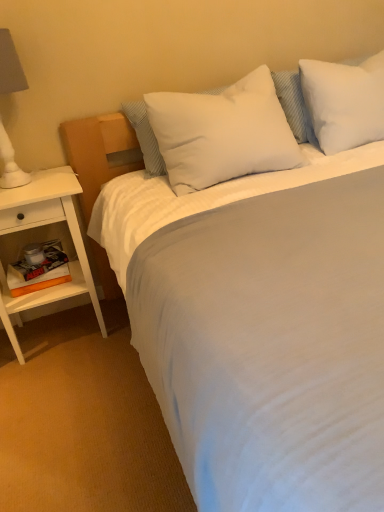
Question: Does white wood nightstand at left have a lesser height compared to white soft pillow at upper right, which is the second pillow from left to right?

Choices:
 (A) no
 (B) yes

Answer: (A)

Question: From a real-world perspective, is white wood nightstand at left positioned over white soft pillow at upper right, the 1th pillow from the right, based on gravity?

Choices:
 (A) yes
 (B) no

Answer: (B)

Question: Is white wood nightstand at left outside white soft pillow at upper right, the 1th pillow from the right?

Choices:
 (A) yes
 (B) no

Answer: (A)

Question: Is white wood nightstand at left closer to the viewer compared to white soft pillow at upper right, the 1th pillow from the right?

Choices:
 (A) yes
 (B) no

Answer: (A)

Question: Can you confirm if white wood nightstand at left is smaller than white soft pillow at upper right, the 1th pillow from the right?

Choices:
 (A) yes
 (B) no

Answer: (B)

Question: Considering the relative sizes of white wood nightstand at left and white soft pillow at upper right, which is the second pillow from left to right, in the image provided, is white wood nightstand at left thinner than white soft pillow at upper right, which is the second pillow from left to right,?

Choices:
 (A) yes
 (B) no

Answer: (B)

Question: Considering the relative sizes of white soft pillow at center, arranged as the first pillow when viewed from the left, and white matte lampshade at left in the image provided, is white soft pillow at center, arranged as the first pillow when viewed from the left, bigger than white matte lampshade at left?

Choices:
 (A) no
 (B) yes

Answer: (B)

Question: Is white soft pillow at center, marked as the second pillow in a right-to-left arrangement, oriented away from white matte lampshade at left?

Choices:
 (A) no
 (B) yes

Answer: (A)

Question: From the image's perspective, would you say white soft pillow at center, arranged as the first pillow when viewed from the left, is shown under white matte lampshade at left?

Choices:
 (A) no
 (B) yes

Answer: (B)

Question: Does white soft pillow at center, marked as the second pillow in a right-to-left arrangement, appear on the right side of white matte lampshade at left?

Choices:
 (A) yes
 (B) no

Answer: (A)

Question: Does white soft pillow at center, marked as the second pillow in a right-to-left arrangement, have a smaller size compared to white matte lampshade at left?

Choices:
 (A) yes
 (B) no

Answer: (B)

Question: Does white soft pillow at center, arranged as the first pillow when viewed from the left, have a lesser width compared to white matte lampshade at left?

Choices:
 (A) yes
 (B) no

Answer: (B)

Question: Is white matte lampshade at left directly adjacent to white wood nightstand at left?

Choices:
 (A) yes
 (B) no

Answer: (B)